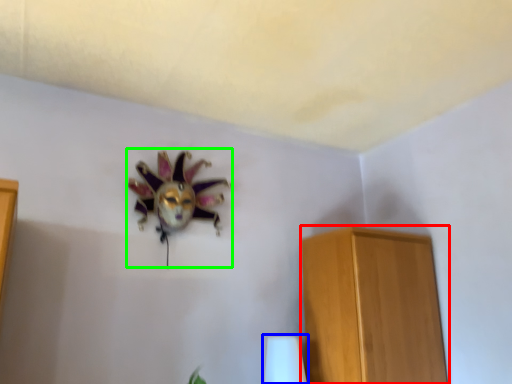
Question: Based on their relative distances, which object is nearer to furniture (highlighted by a red box)? Choose from table lamp (highlighted by a blue box) and animal (highlighted by a green box).

Choices:
 (A) table lamp
 (B) animal

Answer: (A)